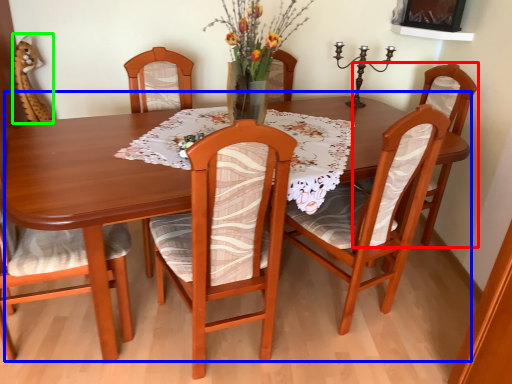
Question: Based on their relative distances, which object is farther from chair (highlighted by a red box)? Choose from kitchen & dining room table (highlighted by a blue box) and armchair (highlighted by a green box).

Choices:
 (A) kitchen & dining room table
 (B) armchair

Answer: (B)